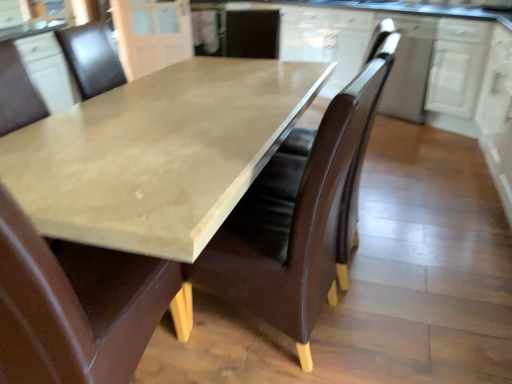
Question: Is white glossy cabinet at upper center, the first cabinetry positioned from the left, facing away from white glossy cabinet at right, positioned as the third cabinetry in left-to-right order?

Choices:
 (A) no
 (B) yes

Answer: (A)

Question: Is the position of white glossy cabinet at upper center, marked as the 4th cabinetry in a right-to-left arrangement, less distant than that of white glossy cabinet at right, which appears as the 2th cabinetry when viewed from the right?

Choices:
 (A) yes
 (B) no

Answer: (B)

Question: Can you confirm if white glossy cabinet at upper center, marked as the 4th cabinetry in a right-to-left arrangement, is thinner than white glossy cabinet at right, which appears as the 2th cabinetry when viewed from the right?

Choices:
 (A) no
 (B) yes

Answer: (B)

Question: Is white glossy cabinet at upper center, the first cabinetry positioned from the left, shorter than white glossy cabinet at right, positioned as the third cabinetry in left-to-right order?

Choices:
 (A) yes
 (B) no

Answer: (B)

Question: Is white glossy cabinet at upper center, marked as the 4th cabinetry in a right-to-left arrangement, positioned far away from white glossy cabinet at right, positioned as the third cabinetry in left-to-right order?

Choices:
 (A) no
 (B) yes

Answer: (B)

Question: From the image's perspective, does white glossy cabinet at upper center, the first cabinetry positioned from the left, appear higher than white glossy cabinet at right, positioned as the third cabinetry in left-to-right order?

Choices:
 (A) yes
 (B) no

Answer: (A)

Question: Is white glossy cabinet at upper right, the 3th cabinetry when ordered from right to left, taller than white glossy cabinet at upper right, arranged as the first cabinetry when viewed from the right?

Choices:
 (A) no
 (B) yes

Answer: (B)

Question: Is white glossy cabinet at upper right, placed as the 2th cabinetry when sorted from left to right, wider than white glossy cabinet at upper right, arranged as the first cabinetry when viewed from the right?

Choices:
 (A) yes
 (B) no

Answer: (A)

Question: Is white glossy cabinet at upper right, placed as the 2th cabinetry when sorted from left to right, smaller than white glossy cabinet at upper right, which is counted as the fourth cabinetry, starting from the left?

Choices:
 (A) yes
 (B) no

Answer: (B)

Question: From the image's perspective, would you say white glossy cabinet at upper right, the 3th cabinetry when ordered from right to left, is positioned over white glossy cabinet at upper right, arranged as the first cabinetry when viewed from the right?

Choices:
 (A) yes
 (B) no

Answer: (A)

Question: Is white glossy cabinet at upper right, placed as the 2th cabinetry when sorted from left to right, outside of white glossy cabinet at upper right, arranged as the first cabinetry when viewed from the right?

Choices:
 (A) yes
 (B) no

Answer: (A)

Question: Is white glossy cabinet at upper right, placed as the 2th cabinetry when sorted from left to right, positioned in front of white glossy cabinet at upper right, arranged as the first cabinetry when viewed from the right?

Choices:
 (A) no
 (B) yes

Answer: (A)

Question: Does matte brown leather chair at center, the second chair viewed from the right, contain brown leather swivel chair at center?

Choices:
 (A) yes
 (B) no

Answer: (B)